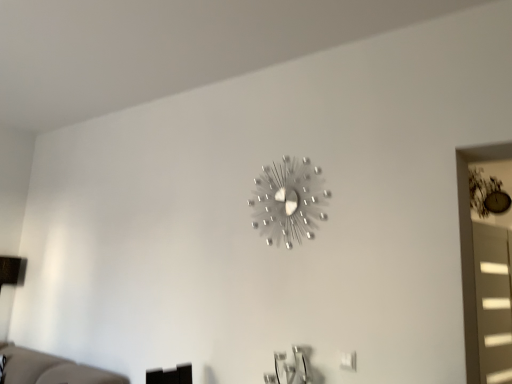
You are a GUI agent. You are given a task and a screenshot of the screen. Output one action in this format:
    pyautogui.click(x=<x>, y=<y>)
    Task: Click on the satin silver clock at upper center
    The image size is (512, 384).
    Given the screenshot: What is the action you would take?
    pyautogui.click(x=289, y=201)

Measure the distance between satin silver clock at upper center and camera.

satin silver clock at upper center is 6.93 feet away from camera.

What do you see at coordinates (289, 201) in the screenshot? I see `satin silver clock at upper center` at bounding box center [289, 201].

The width and height of the screenshot is (512, 384). Find the location of `matte gray window at right`. matte gray window at right is located at coordinates (472, 247).

What do you see at coordinates (472, 247) in the screenshot?
I see `matte gray window at right` at bounding box center [472, 247].

Identify the location of satin silver clock at upper center. Image resolution: width=512 pixels, height=384 pixels. 289,201.

Which is more to the left, matte gray window at right or satin silver clock at upper center?

satin silver clock at upper center is more to the left.

Is the depth of matte gray window at right less than that of satin silver clock at upper center?

That is False.

Is point (466, 188) closer or farther from the camera than point (285, 233)?

Point (466, 188) is closer to the camera than point (285, 233).

From the image's perspective, is matte gray window at right below satin silver clock at upper center?

Yes.

From a real-world perspective, is matte gray window at right beneath satin silver clock at upper center?

Yes, from a real-world perspective, matte gray window at right is under satin silver clock at upper center.

From the picture: Which of these two, matte gray window at right or satin silver clock at upper center, is wider?

With larger width is matte gray window at right.

Between matte gray window at right and satin silver clock at upper center, which one has less height?

Standing shorter between the two is satin silver clock at upper center.

Does matte gray window at right have a smaller size compared to satin silver clock at upper center?

No, matte gray window at right is not smaller than satin silver clock at upper center.

Could satin silver clock at upper center be considered to be inside matte gray window at right?

Definitely not — satin silver clock at upper center is not inside matte gray window at right.

Is matte gray window at right touching satin silver clock at upper center?

No, matte gray window at right is not beside satin silver clock at upper center.

Is matte gray window at right facing away from satin silver clock at upper center?

No.

How different are the orientations of matte gray window at right and satin silver clock at upper center in degrees?

There is a 85.5-degree angle between the facing directions of matte gray window at right and satin silver clock at upper center.

This screenshot has width=512, height=384. Find the location of `wall clock in front of the matte gray window at right`. wall clock in front of the matte gray window at right is located at coordinates click(x=289, y=201).

Between satin silver clock at upper center and matte gray window at right, which one appears on the left side from the viewer's perspective?

satin silver clock at upper center is more to the left.

In the scene shown: Between satin silver clock at upper center and matte gray window at right, which one is positioned in front?

satin silver clock at upper center.

Which is further, (318, 217) or (463, 262)?

Positioned behind is point (318, 217).

From the image's perspective, between satin silver clock at upper center and matte gray window at right, who is located below?

matte gray window at right, from the image's perspective.

From a real-world perspective, which is physically above, satin silver clock at upper center or matte gray window at right?

satin silver clock at upper center.

Considering the relative sizes of satin silver clock at upper center and matte gray window at right in the image provided, is satin silver clock at upper center wider than matte gray window at right?

No, satin silver clock at upper center is not wider than matte gray window at right.

Does satin silver clock at upper center have a lesser height compared to matte gray window at right?

Yes, satin silver clock at upper center is shorter than matte gray window at right.

Considering the sizes of objects satin silver clock at upper center and matte gray window at right in the image provided, who is smaller, satin silver clock at upper center or matte gray window at right?

Smaller between the two is satin silver clock at upper center.

Do you think satin silver clock at upper center is within matte gray window at right, or outside of it?

satin silver clock at upper center is outside matte gray window at right.

Is satin silver clock at upper center placed right next to matte gray window at right?

satin silver clock at upper center and matte gray window at right are not in contact.

Could you tell me if satin silver clock at upper center is turned towards matte gray window at right?

No, satin silver clock at upper center is not facing towards matte gray window at right.

Find the location of a particular element. This screenshot has height=384, width=512. wall clock above the matte gray window at right (from a real-world perspective) is located at coordinates (289, 201).

Locate an element on the screen. The image size is (512, 384). wall clock that appears in front of the matte gray window at right is located at coordinates (289, 201).

Locate an element on the screen. wall clock located above the matte gray window at right (from a real-world perspective) is located at coordinates (289, 201).